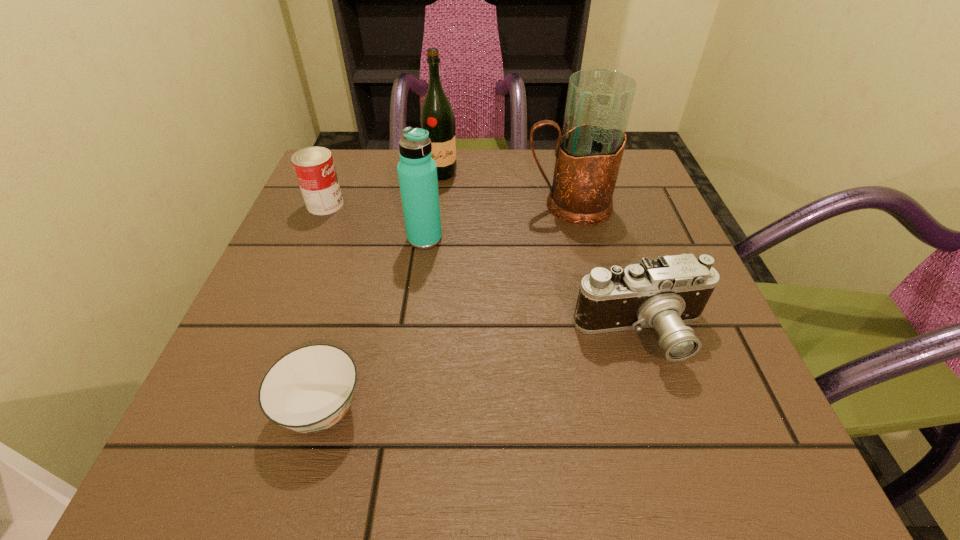
Where is `free location located with the handle on the side of the pitcher`? free location located with the handle on the side of the pitcher is located at coordinates (371, 206).

What are the coordinates of `free location located with the handle on the side of the pitcher` in the screenshot? It's located at (394, 206).

At what (x,y) coordinates should I click in order to perform the action: click on free spot located on the front of the third tallest object. Please return your answer as a coordinate pair (x, y). This screenshot has height=540, width=960. Looking at the image, I should click on (420, 275).

Locate an element on the screen. free spot located 0.190m on the front label of the leftmost object is located at coordinates (429, 205).

Locate an element on the screen. This screenshot has height=540, width=960. vacant space located at the lens of the camera is located at coordinates (666, 408).

In order to click on free space located on the right of the shortest object in this screenshot , I will do `click(533, 409)`.

At what (x,y) coordinates should I click in order to perform the action: click on liquor positioned at the far edge. Please return your answer as a coordinate pair (x, y). Looking at the image, I should click on (437, 117).

You are a GUI agent. You are given a task and a screenshot of the screen. Output one action in this format:
    pyautogui.click(x=<x>, y=<y>)
    Task: Click on the pitcher positioned at the far edge
    
    Given the screenshot: What is the action you would take?
    pyautogui.click(x=589, y=151)

The height and width of the screenshot is (540, 960). In order to click on can located at the far edge in this screenshot , I will do `click(314, 167)`.

At what (x,y) coordinates should I click in order to perform the action: click on object that is at the near edge. Please return your answer as a coordinate pair (x, y). Looking at the image, I should click on (308, 390).